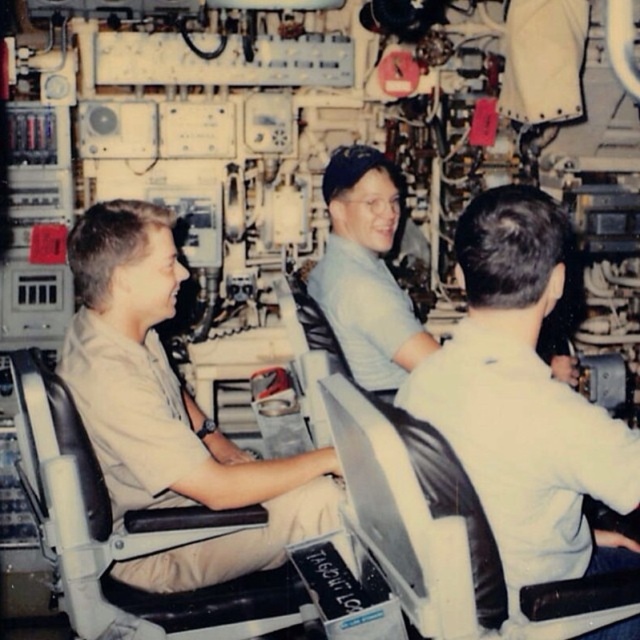
Between white matte shirt at center and light blue shirt at center, which one has more height?

With more height is white matte shirt at center.

This screenshot has height=640, width=640. Describe the element at coordinates (524, 400) in the screenshot. I see `white matte shirt at center` at that location.

Identify the location of white matte shirt at center. The width and height of the screenshot is (640, 640). (524, 400).

Can you confirm if black leather chair at left is shorter than black leather chair at center?

Incorrect, black leather chair at left's height does not fall short of black leather chair at center's.

Measure the distance from black leather chair at left to black leather chair at center.

black leather chair at left and black leather chair at center are 21.54 inches apart.

Locate an element on the screen. Image resolution: width=640 pixels, height=640 pixels. black leather chair at left is located at coordinates (131, 536).

Find the location of a particular element. Image resolution: width=640 pixels, height=640 pixels. black leather chair at left is located at coordinates (131, 536).

Does light brown uniform at left have a smaller size compared to light blue shirt at center?

Actually, light brown uniform at left might be larger than light blue shirt at center.

The height and width of the screenshot is (640, 640). Find the location of `light brown uniform at left`. light brown uniform at left is located at coordinates (170, 412).